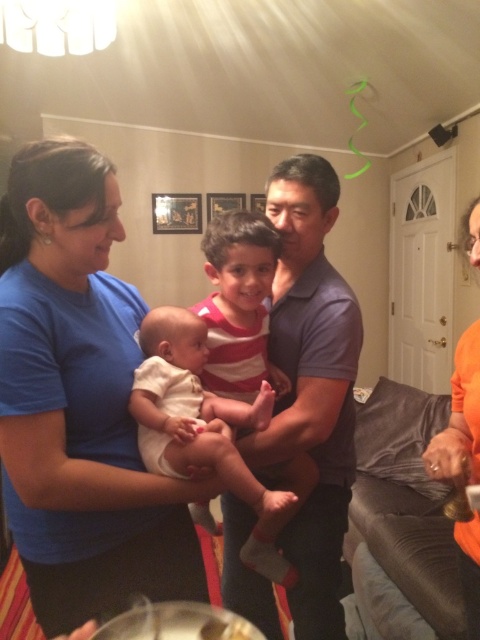
How far apart are striped fabric shirt at center and white soft baby at center?

striped fabric shirt at center and white soft baby at center are 5.47 inches apart from each other.

Between striped fabric shirt at center and white soft baby at center, which one appears on the left side from the viewer's perspective?

Positioned to the left is white soft baby at center.

Is point (276, 253) more distant than point (189, 348)?

That is True.

The height and width of the screenshot is (640, 480). What are the coordinates of `striped fabric shirt at center` in the screenshot? It's located at (239, 305).

Which is in front, point (33, 508) or point (348, 308)?

Point (33, 508)

Is blue fabric shirt at left wider than dark blue shirt at center?

Indeed, blue fabric shirt at left has a greater width compared to dark blue shirt at center.

Is point (167, 547) closer to camera compared to point (312, 227)?

Yes, point (167, 547) is in front of point (312, 227).

In order to click on blue fabric shirt at left in this screenshot , I will do `click(78, 400)`.

Is point (355, 378) closer to viewer compared to point (228, 348)?

No, it is not.

From the picture: How far apart are dark blue shirt at center and striped fabric shirt at center?

dark blue shirt at center and striped fabric shirt at center are 4.30 inches apart from each other.

Does point (283, 308) come behind point (224, 349)?

Yes, point (283, 308) is farther from viewer.

Locate an element on the screen. dark blue shirt at center is located at coordinates (311, 387).